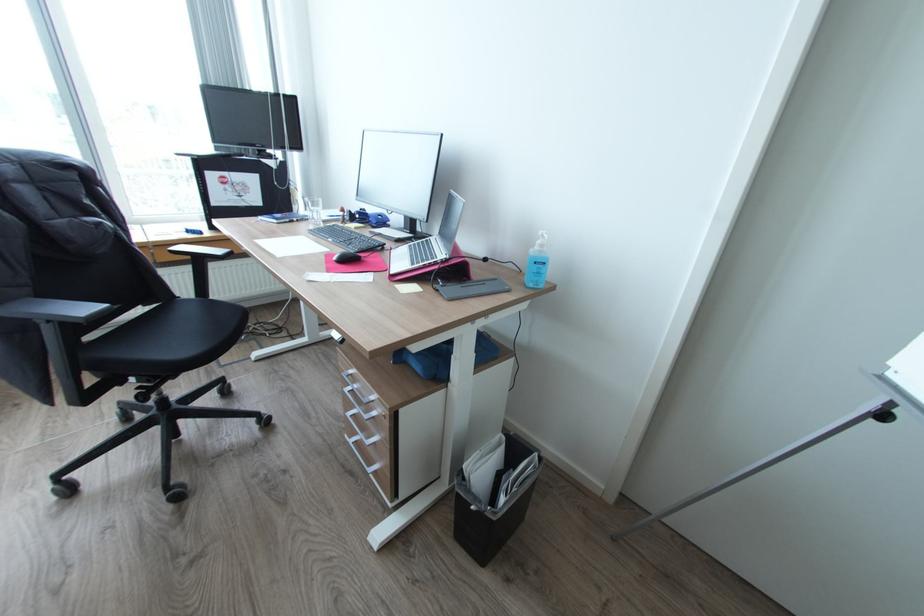
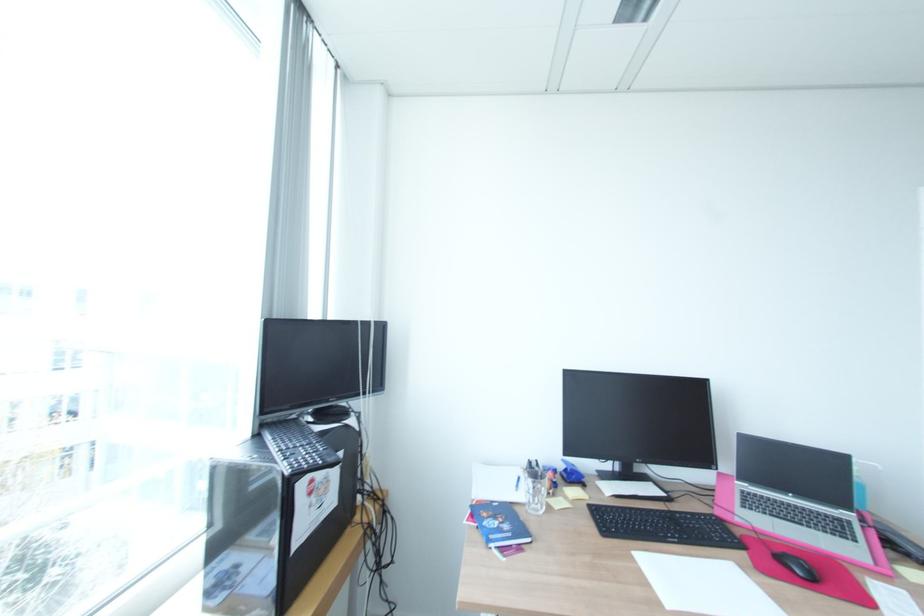
In the second image, find the point that corresponds to (416,248) in the first image.

(770, 513)